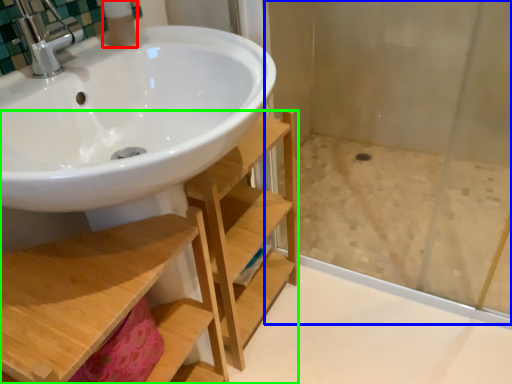
Question: Which is farther away from toiletry (highlighted by a red box)? shower door (highlighted by a blue box) or shelf (highlighted by a green box)?

Choices:
 (A) shower door
 (B) shelf

Answer: (A)